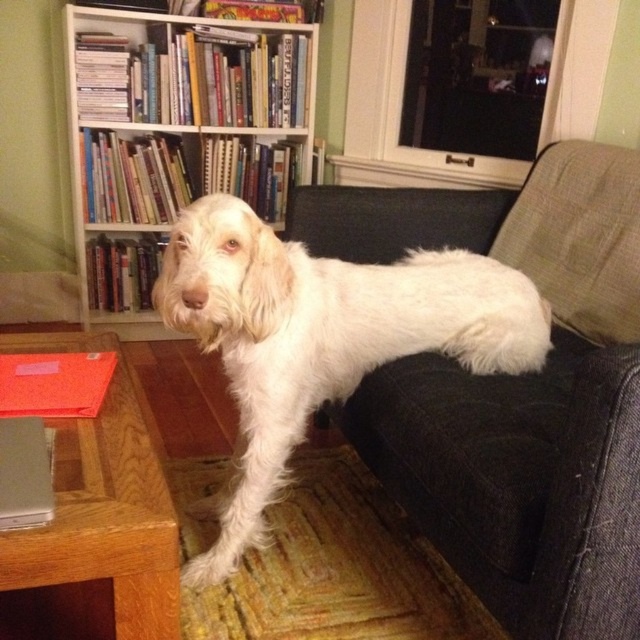
Can you confirm if white wood bookcase at upper center is wider than wooden table at lower left?

Indeed, white wood bookcase at upper center has a greater width compared to wooden table at lower left.

Does white wood bookcase at upper center have a lesser height compared to wooden table at lower left?

In fact, white wood bookcase at upper center may be taller than wooden table at lower left.

Who is more distant from viewer, (106, 72) or (22, 531)?

The point (106, 72) is behind.

This screenshot has height=640, width=640. What are the coordinates of `white wood bookcase at upper center` in the screenshot? It's located at click(179, 122).

Does white fabric armchair at right have a lesser height compared to white wood bookcase at upper center?

Indeed, white fabric armchair at right has a lesser height compared to white wood bookcase at upper center.

Does point (492, 202) lie in front of point (154, 198)?

Yes, it is in front of point (154, 198).

Locate an element on the screen. This screenshot has height=640, width=640. white fabric armchair at right is located at coordinates (515, 390).

Identify the location of white fabric armchair at right. The height and width of the screenshot is (640, 640). (515, 390).

Can you confirm if white fabric armchair at right is positioned above white fluffy dog at center?

Yes.

Is point (417, 518) closer to camera compared to point (228, 378)?

Yes, it is.

Where is `white fabric armchair at right`? white fabric armchair at right is located at coordinates pyautogui.click(x=515, y=390).